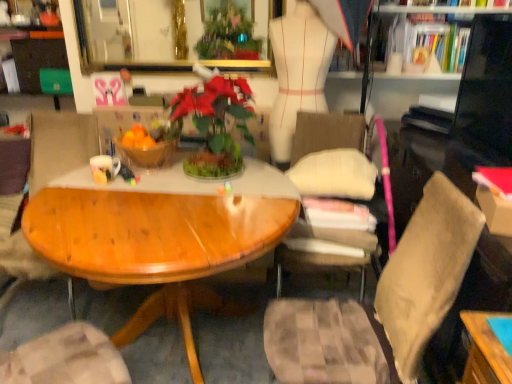
Question: Is glossy wood table at center to the right of wooden chair at left, which is counted as the 2th chair, starting from the right, from the viewer's perspective?

Choices:
 (A) no
 (B) yes

Answer: (B)

Question: Is glossy wood table at center smaller than wooden chair at left, which ranks as the first chair in left-to-right order?

Choices:
 (A) no
 (B) yes

Answer: (A)

Question: From a real-world perspective, is glossy wood table at center physically above wooden chair at left, which is counted as the 2th chair, starting from the right?

Choices:
 (A) yes
 (B) no

Answer: (B)

Question: Is the position of glossy wood table at center more distant than that of wooden chair at left, which ranks as the first chair in left-to-right order?

Choices:
 (A) yes
 (B) no

Answer: (B)

Question: Does glossy wood table at center have a greater width compared to wooden chair at left, which ranks as the first chair in left-to-right order?

Choices:
 (A) yes
 (B) no

Answer: (B)

Question: Could you tell me if glossy wood table at center is facing wooden chair at left, which is counted as the 2th chair, starting from the right?

Choices:
 (A) yes
 (B) no

Answer: (B)

Question: Considering the relative positions of hardcover book at upper right, arranged as the second book when viewed from the back, and wooden bowl at center in the image provided, is hardcover book at upper right, arranged as the second book when viewed from the back, behind wooden bowl at center?

Choices:
 (A) yes
 (B) no

Answer: (A)

Question: Is hardcover book at upper right, the 2th book from the front, far from wooden bowl at center?

Choices:
 (A) no
 (B) yes

Answer: (B)

Question: Does hardcover book at upper right, the 2th book from the front, appear on the right side of wooden bowl at center?

Choices:
 (A) no
 (B) yes

Answer: (B)

Question: From the image's perspective, is hardcover book at upper right, the 1th book when ordered from top to bottom, on wooden bowl at center?

Choices:
 (A) no
 (B) yes

Answer: (B)

Question: Considering the relative sizes of hardcover book at upper right, arranged as the 3th book when ordered from the bottom, and wooden bowl at center in the image provided, is hardcover book at upper right, arranged as the 3th book when ordered from the bottom, smaller than wooden bowl at center?

Choices:
 (A) yes
 (B) no

Answer: (B)

Question: From the image's perspective, is hardcover book at upper right, the 2th book from the front, below wooden bowl at center?

Choices:
 (A) no
 (B) yes

Answer: (A)

Question: Is wooden bowl at center shorter than white paper book at upper right, which is the 1th book from back to front?

Choices:
 (A) yes
 (B) no

Answer: (B)